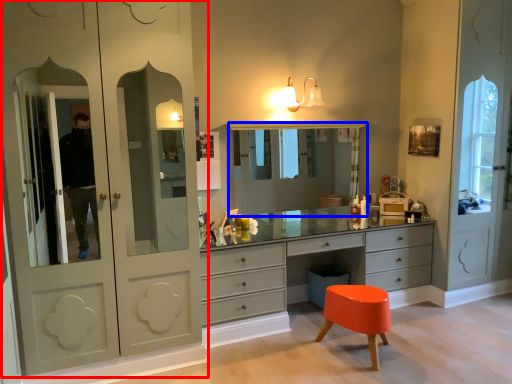
Question: Which point is further to the camera, cupboard (highlighted by a red box) or medicine cabinet (highlighted by a blue box)?

Choices:
 (A) cupboard
 (B) medicine cabinet

Answer: (B)